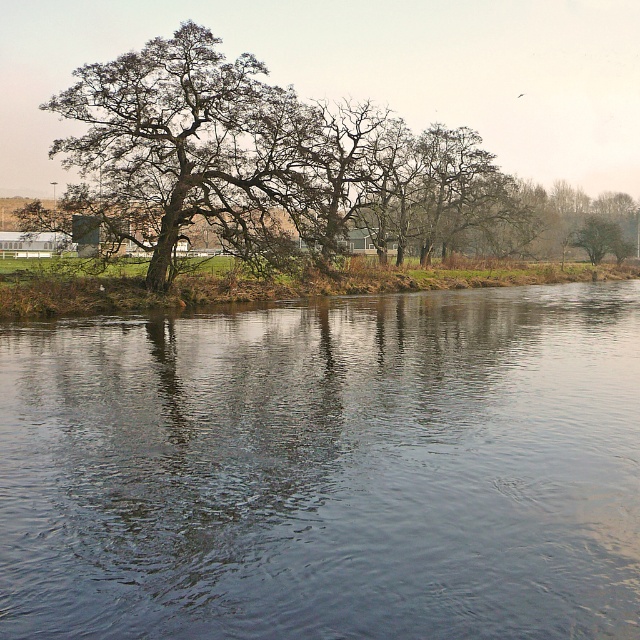
Who is positioned more to the left, dark green textured oak tree at center or smooth brown tree at right?

dark green textured oak tree at center is more to the left.

Does point (262, 163) lie behind point (605, 250)?

No, (262, 163) is in front of (605, 250).

Find the location of a particular element. dark green textured oak tree at center is located at coordinates tap(188, 145).

Is brown textured tree at center further to camera compared to dark green textured oak tree at center?

Yes, it is.

Which of these two, brown textured tree at center or dark green textured oak tree at center, stands taller?

Standing taller between the two is brown textured tree at center.

Is point (259, 42) farther from viewer compared to point (278, 180)?

Yes.

Find the location of a particular element. This screenshot has height=640, width=640. brown textured tree at center is located at coordinates (362, 72).

Who is more forward, (355, 497) or (163, 280)?

Positioned in front is point (355, 497).

Which is in front, point (49, 356) or point (250, 68)?

Point (49, 356) is more forward.

Locate an element on the screen. This screenshot has width=640, height=640. dark blue water at center is located at coordinates (326, 468).